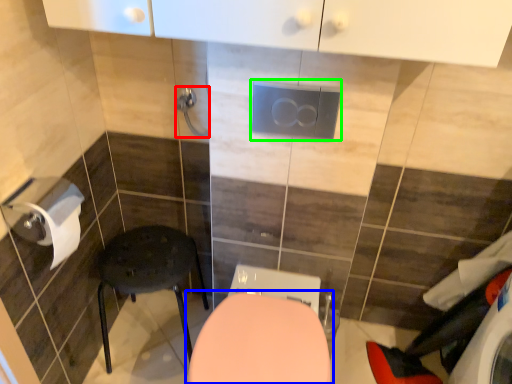
Question: Based on their relative distances, which object is farther from towel bar (highlighted by a red box)? Choose from toilet (highlighted by a blue box) and electric outlet (highlighted by a green box).

Choices:
 (A) toilet
 (B) electric outlet

Answer: (A)